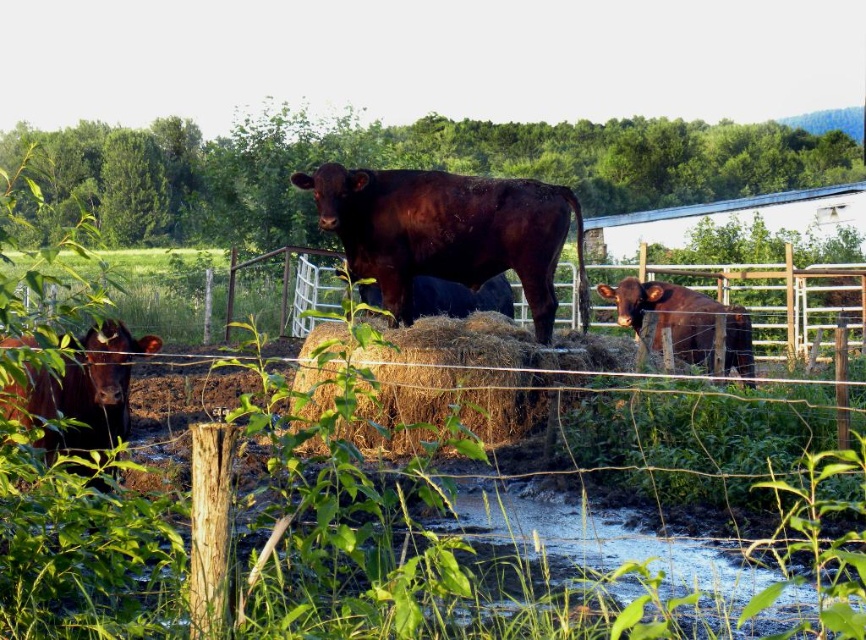
Question: Does shiny dark brown bull at center have a greater width compared to white wire fence at center?

Choices:
 (A) no
 (B) yes

Answer: (A)

Question: Is brown straw bale at center smaller than shiny brown bull at left?

Choices:
 (A) yes
 (B) no

Answer: (B)

Question: Which object is farther from the camera taking this photo?

Choices:
 (A) shiny brown cow at center
 (B) shiny dark brown bull at center
 (C) shiny brown bull at left

Answer: (A)

Question: Can you confirm if brown hay at center is positioned to the left of brown straw bale at center?

Choices:
 (A) no
 (B) yes

Answer: (A)

Question: Based on their relative distances, which object is nearer to the shiny dark brown bull at center?

Choices:
 (A) white wire fence at center
 (B) shiny brown cow at center
 (C) brown hay at center
 (D) shiny brown bull at left

Answer: (B)

Question: Which object appears closest to the camera in this image?

Choices:
 (A) brown hay at center
 (B) shiny brown cow at center
 (C) shiny brown bull at left
 (D) white wire fence at center

Answer: (A)